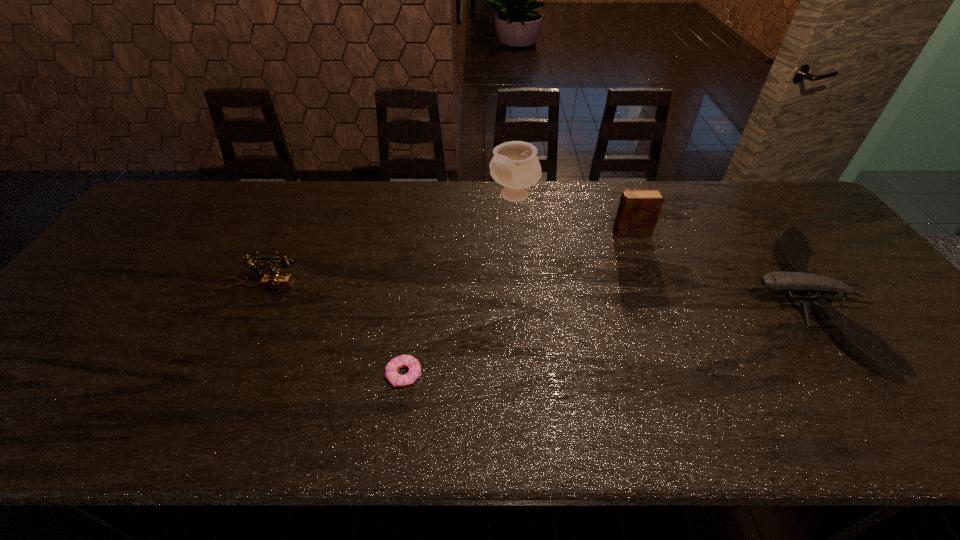
Locate an element on the screen. vacant space located 0.150m on the spine side of the diary is located at coordinates (563, 232).

You are a GUI agent. You are given a task and a screenshot of the screen. Output one action in this format:
    pyautogui.click(x=<x>, y=<y>)
    Task: Click on the vacant position located 0.070m on the spine side of the diary
    This screenshot has width=960, height=540.
    Given the screenshot: What is the action you would take?
    pyautogui.click(x=588, y=232)

In order to click on vacant region located on the front-facing side of the telephone in this screenshot , I will do `click(241, 321)`.

Identify the location of free space located 0.180m at the head of the drone. The image size is (960, 540). pyautogui.click(x=680, y=301).

Image resolution: width=960 pixels, height=540 pixels. What are the coordinates of `free spot located 0.130m at the head of the drone` in the screenshot? It's located at (699, 301).

Locate an element on the screen. The image size is (960, 540). blank area located at the head of the drone is located at coordinates (691, 301).

Image resolution: width=960 pixels, height=540 pixels. I want to click on vacant space situated on the back of the shortest object, so click(x=410, y=336).

The width and height of the screenshot is (960, 540). I want to click on object located at the far edge, so click(514, 165).

Identify the location of object present at the right edge. (795, 244).

Where is `free region at the far edge of the desktop`? This screenshot has width=960, height=540. free region at the far edge of the desktop is located at coordinates (584, 184).